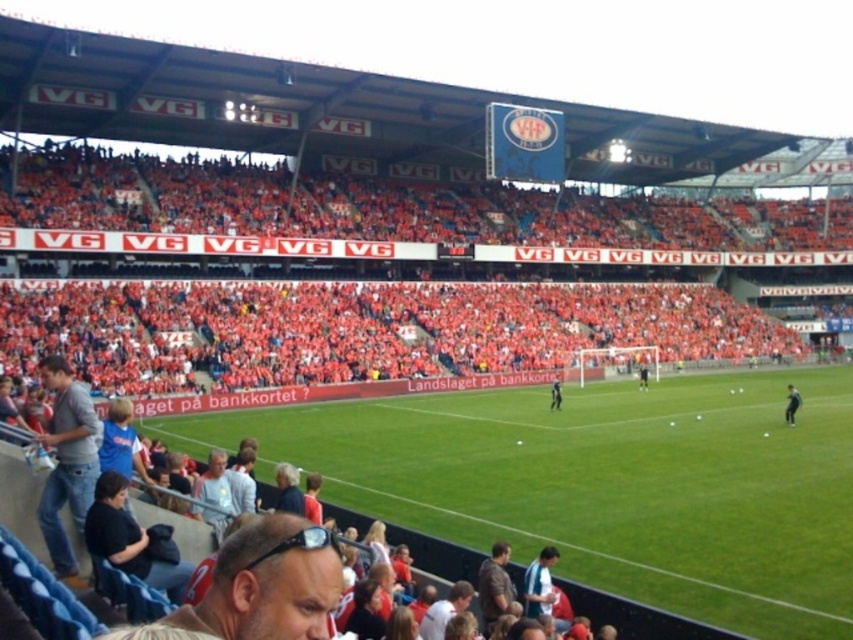
Who is more forward, (158, 557) or (212, 515)?

Point (158, 557) is in front.

Can you confirm if black fabric jacket at lower left is thinner than light gray shirt at lower center?

Indeed, black fabric jacket at lower left has a lesser width compared to light gray shirt at lower center.

Who is more forward, (173, 598) or (241, 486)?

Point (173, 598) is in front.

Find the location of a particular element. black fabric jacket at lower left is located at coordinates (131, 540).

Which is in front, point (86, 429) or point (195, 516)?

Point (86, 429) is in front.

Between denim jeans at lower left and light gray shirt at lower center, which one is positioned lower?

Positioned lower is light gray shirt at lower center.

This screenshot has width=853, height=640. I want to click on denim jeans at lower left, so click(67, 461).

Locate an element on the screen. This screenshot has height=640, width=853. denim jeans at lower left is located at coordinates (67, 461).

Can you confirm if denim jeans at lower left is thinner than brown leather jacket at lower center?

Incorrect, denim jeans at lower left's width is not less than brown leather jacket at lower center's.

Who is lower down, denim jeans at lower left or brown leather jacket at lower center?

brown leather jacket at lower center is below.

Who is more forward, (x=88, y=412) or (x=497, y=612)?

Point (x=497, y=612)

Identify the location of denim jeans at lower left. The height and width of the screenshot is (640, 853). (67, 461).